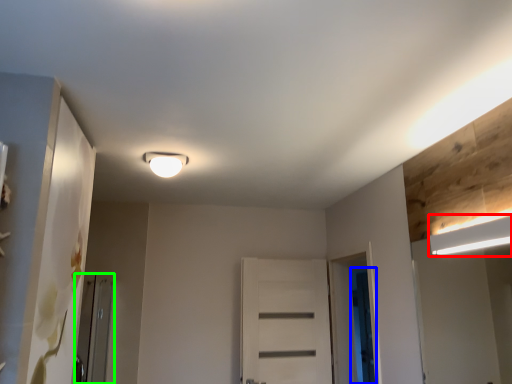
Question: Considering the real-world distances, which object is closest to lamp (highlighted by a red box)? screen door (highlighted by a blue box) or screen door (highlighted by a green box).

Choices:
 (A) screen door
 (B) screen door

Answer: (A)